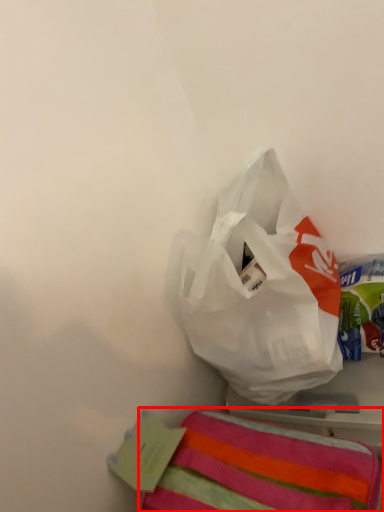
Question: From the image's perspective, where is towel (annotated by the red box) located relative to plastic bag?

Choices:
 (A) above
 (B) below

Answer: (B)